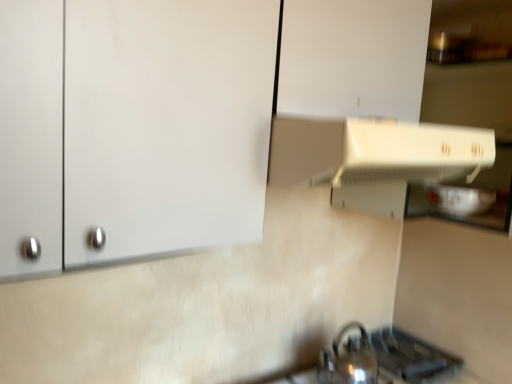
Question: Should I look upward or downward to see white matte cabinet at upper left?

Choices:
 (A) up
 (B) down

Answer: (A)

Question: Is white matte cabinet at upper left in front of shiny metallic tea pot at lower right?

Choices:
 (A) yes
 (B) no

Answer: (A)

Question: Is white matte cabinet at upper left shorter than shiny metallic tea pot at lower right?

Choices:
 (A) no
 (B) yes

Answer: (A)

Question: From a real-world perspective, is white matte cabinet at upper left physically above shiny metallic tea pot at lower right?

Choices:
 (A) no
 (B) yes

Answer: (B)

Question: Does white matte cabinet at upper left have a greater height compared to shiny metallic tea pot at lower right?

Choices:
 (A) yes
 (B) no

Answer: (A)

Question: Would you say white matte cabinet at upper left is outside shiny metallic tea pot at lower right?

Choices:
 (A) no
 (B) yes

Answer: (B)

Question: Is white matte cabinet at upper left behind shiny metallic tea pot at lower right?

Choices:
 (A) no
 (B) yes

Answer: (A)

Question: Considering the relative sizes of metallic silver gas stove at lower right and white matte cabinet at upper left in the image provided, is metallic silver gas stove at lower right shorter than white matte cabinet at upper left?

Choices:
 (A) no
 (B) yes

Answer: (B)

Question: From the image's perspective, does metallic silver gas stove at lower right appear higher than white matte cabinet at upper left?

Choices:
 (A) yes
 (B) no

Answer: (B)

Question: Is metallic silver gas stove at lower right not within white matte cabinet at upper left?

Choices:
 (A) yes
 (B) no

Answer: (A)

Question: Is the surface of metallic silver gas stove at lower right in direct contact with white matte cabinet at upper left?

Choices:
 (A) no
 (B) yes

Answer: (A)

Question: Could you tell me if metallic silver gas stove at lower right is facing white matte cabinet at upper left?

Choices:
 (A) no
 (B) yes

Answer: (A)

Question: Does metallic silver gas stove at lower right have a larger size compared to white matte cabinet at upper left?

Choices:
 (A) yes
 (B) no

Answer: (B)

Question: Would you say white matte cabinet at upper left contains metallic silver gas stove at lower right?

Choices:
 (A) no
 (B) yes

Answer: (A)